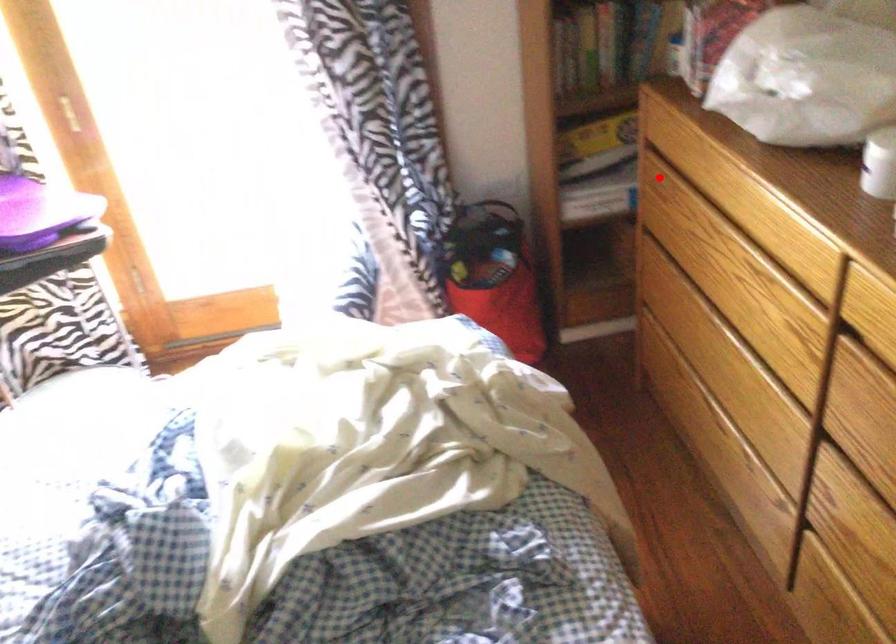
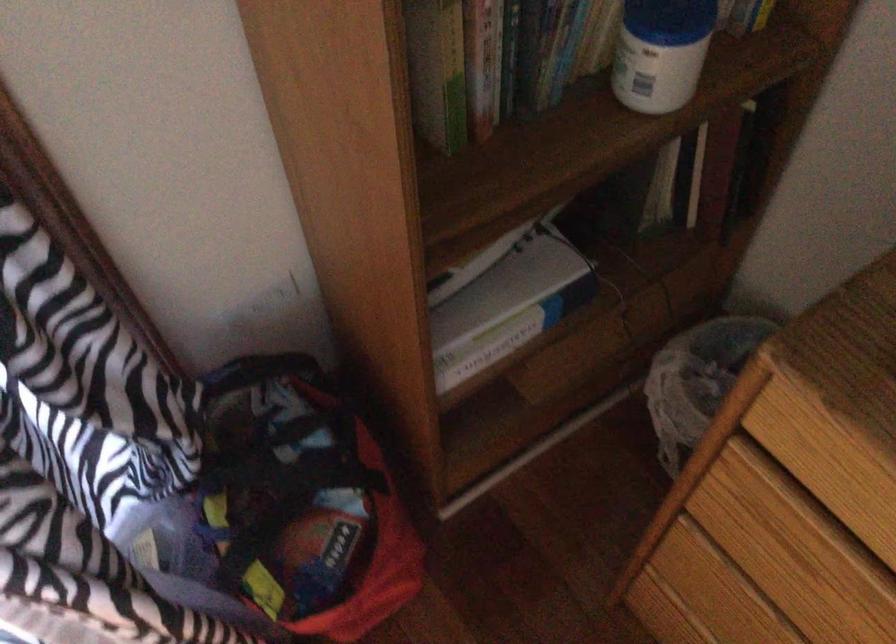
Find the pixel in the second image that matches the highlighted location in the first image.

(780, 526)